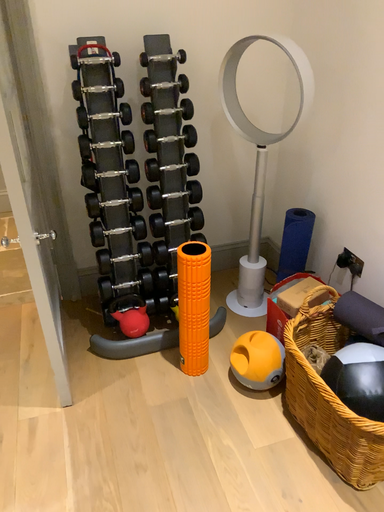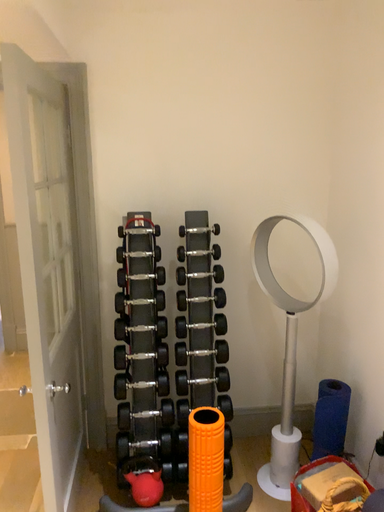
Question: How did the camera likely rotate when shooting the video?

Choices:
 (A) rotated left
 (B) rotated right

Answer: (A)